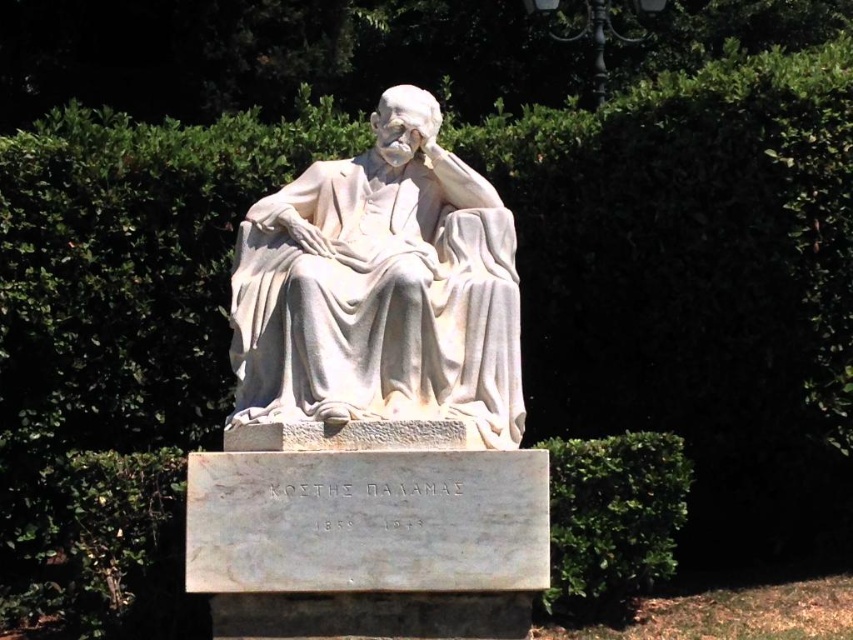
Measure the distance between point (305, 330) and camera.

24.85 meters

Can you confirm if white marble statue at center is positioned below green leafy hedge at lower right?

Actually, white marble statue at center is above green leafy hedge at lower right.

Does point (514, 339) come in front of point (663, 452)?

Yes, point (514, 339) is in front of point (663, 452).

Locate an element on the screen. white marble statue at center is located at coordinates (380, 289).